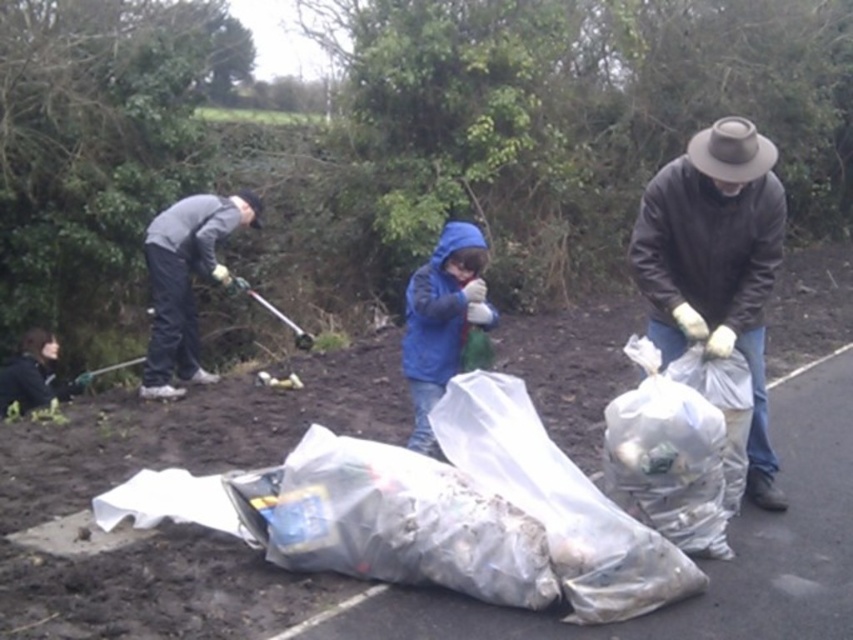
Question: Which point is closer to the camera?

Choices:
 (A) (695, 138)
 (B) (202, 248)
 (C) (444, 269)

Answer: (A)

Question: From the image, what is the correct spatial relationship of transparent plastic bag at center in relation to gray fabric jacket at left?

Choices:
 (A) below
 (B) above

Answer: (A)

Question: Which of the following is the closest to the observer?

Choices:
 (A) dark brown leather jacket at right
 (B) gray fabric jacket at left

Answer: (A)

Question: Among these objects, which one is nearest to the camera?

Choices:
 (A) gray fabric jacket at left
 (B) blue fleece jacket at center
 (C) transparent plastic bag at center

Answer: (C)

Question: Can you confirm if dark brown leather jacket at right is positioned below gray fabric jacket at left?

Choices:
 (A) no
 (B) yes

Answer: (B)

Question: Does transparent plastic bag at center appear on the left side of brown felt cowboy hat at upper right?

Choices:
 (A) yes
 (B) no

Answer: (A)